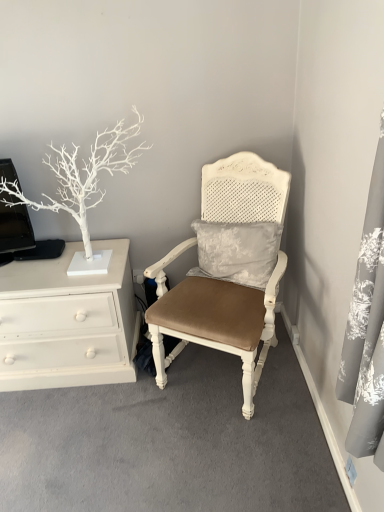
I want to click on vacant space underneath matte white chair at center (from a real-world perspective), so click(x=211, y=373).